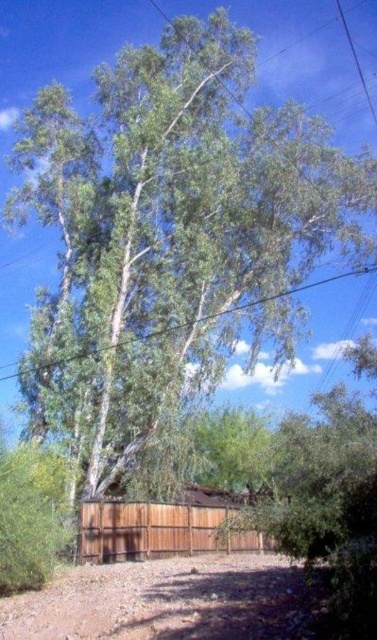
From the picture: You are standing at the entrance of the driveway and want to walk to the tree. Given the coordinates provided, can you determine the direction you should walk to reach the tree from the brown gravel dirt track at lower center?

The brown gravel dirt track at lower center is located at coordinates point [167,602]. Since the tree is in the upper part of the image, you should walk towards the upper direction from the brown gravel dirt track at lower center to reach the tree.